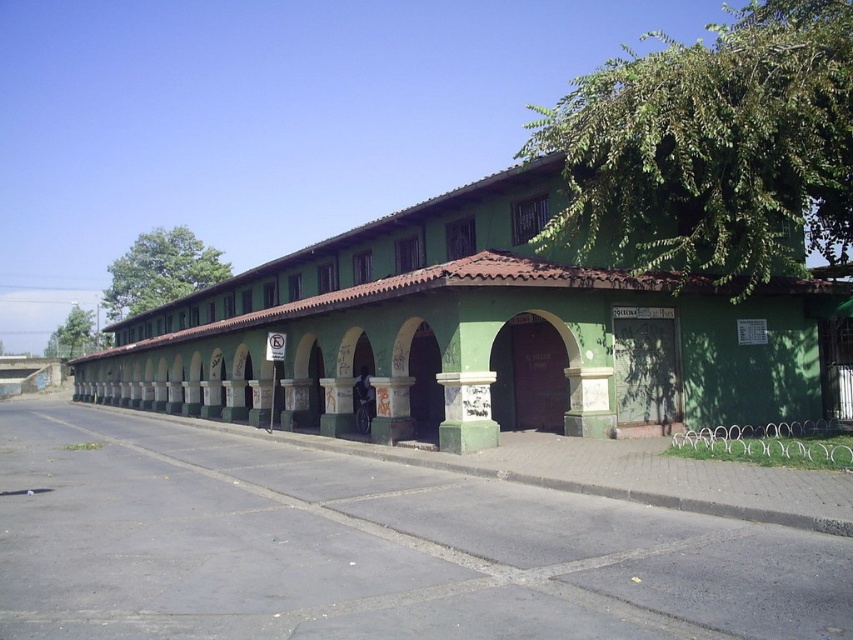
Question: Which point appears farthest from the camera in this image?

Choices:
 (A) (199, 268)
 (B) (70, 326)

Answer: (B)

Question: Which point appears closest to the camera in this image?

Choices:
 (A) coord(125,288)
 (B) coord(45,353)

Answer: (A)

Question: Where is green leafy tree at upper right located in relation to green leafy tree at left in the image?

Choices:
 (A) right
 (B) left

Answer: (A)

Question: Does green leafy tree at upper right lie in front of green leafy tree at left?

Choices:
 (A) yes
 (B) no

Answer: (A)

Question: Is green leafy tree at upper right to the right of green leafy tree at left from the viewer's perspective?

Choices:
 (A) yes
 (B) no

Answer: (A)

Question: Which of the following is the closest to the observer?

Choices:
 (A) green leafy tree at upper left
 (B) green leafy tree at left
 (C) green leafy tree at upper right

Answer: (C)